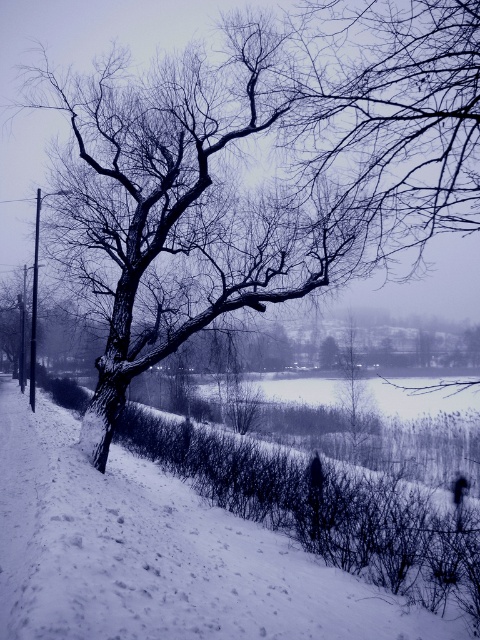
Can you confirm if bare wood tree at center is taller than white fluffy snow at center?

Indeed, bare wood tree at center has a greater height compared to white fluffy snow at center.

How far apart are bare wood tree at center and white fluffy snow at center?

bare wood tree at center and white fluffy snow at center are 4.92 meters apart from each other.

You are a GUI agent. You are given a task and a screenshot of the screen. Output one action in this format:
    pyautogui.click(x=<x>, y=<y>)
    Task: Click on the bare wood tree at center
    
    Given the screenshot: What is the action you would take?
    [287, 150]